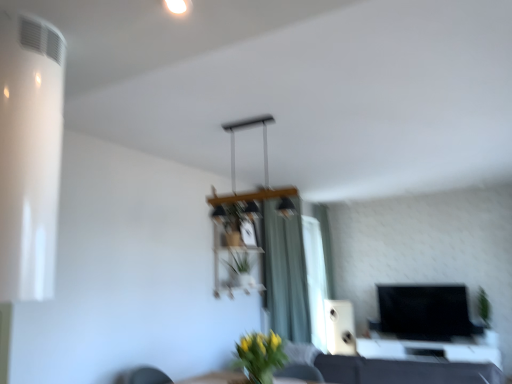
Question: From a real-world perspective, is green matte vase at lower center under green fabric curtain at center, which is the first curtain in front-to-back order?

Choices:
 (A) no
 (B) yes

Answer: (B)

Question: Can you confirm if green matte vase at lower center is shorter than green fabric curtain at center, which appears as the second curtain when viewed from the back?

Choices:
 (A) no
 (B) yes

Answer: (B)

Question: Is green matte vase at lower center positioned beyond the bounds of green fabric curtain at center, arranged as the first curtain when viewed from the left?

Choices:
 (A) yes
 (B) no

Answer: (A)

Question: Can you confirm if green matte vase at lower center is wider than green fabric curtain at center, arranged as the first curtain when viewed from the left?

Choices:
 (A) yes
 (B) no

Answer: (B)

Question: Is green matte vase at lower center looking in the opposite direction of green fabric curtain at center, which appears as the second curtain when viewed from the back?

Choices:
 (A) yes
 (B) no

Answer: (A)

Question: In terms of size, does green fabric curtain at right, the 2th curtain in the front-to-back sequence, appear bigger or smaller than black glossy table at lower right?

Choices:
 (A) big
 (B) small

Answer: (B)

Question: Is green fabric curtain at right, the 2th curtain in the front-to-back sequence, inside the boundaries of black glossy table at lower right, or outside?

Choices:
 (A) inside
 (B) outside

Answer: (B)

Question: In terms of width, does green fabric curtain at right, which is the 1th curtain from back to front, look wider or thinner when compared to black glossy table at lower right?

Choices:
 (A) wide
 (B) thin

Answer: (B)

Question: From a real-world perspective, is green fabric curtain at right, the 2th curtain in the front-to-back sequence, physically located above or below black glossy table at lower right?

Choices:
 (A) below
 (B) above

Answer: (B)

Question: Does point (448, 349) appear closer or farther from the camera than point (276, 306)?

Choices:
 (A) farther
 (B) closer

Answer: (B)

Question: Considering the positions of black glossy table at lower right and green fabric curtain at center, which appears as the second curtain when viewed from the back, in the image, is black glossy table at lower right taller or shorter than green fabric curtain at center, which appears as the second curtain when viewed from the back,?

Choices:
 (A) tall
 (B) short

Answer: (B)

Question: Looking at the image, does black glossy table at lower right seem bigger or smaller compared to green fabric curtain at center, placed as the 2th curtain when sorted from right to left?

Choices:
 (A) big
 (B) small

Answer: (B)

Question: Considering the positions of black glossy table at lower right and green fabric curtain at center, which appears as the second curtain when viewed from the back, in the image, is black glossy table at lower right wider or thinner than green fabric curtain at center, which appears as the second curtain when viewed from the back,?

Choices:
 (A) thin
 (B) wide

Answer: (B)

Question: From a real-world perspective, is yellow matte vase at center, which is counted as the 1th plant, starting from the left, positioned above or below green fabric curtain at center, which is the first curtain in front-to-back order?

Choices:
 (A) below
 (B) above

Answer: (A)

Question: Is yellow matte vase at center, acting as the 1th plant starting from the front, to the left or to the right of green fabric curtain at center, which is the first curtain in front-to-back order, in the image?

Choices:
 (A) left
 (B) right

Answer: (A)